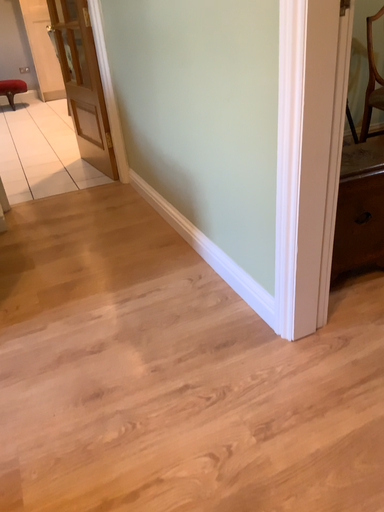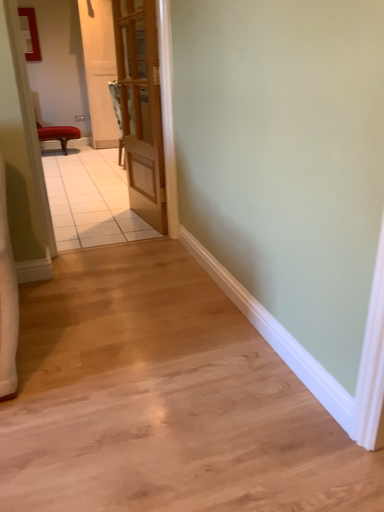
Question: How did the camera likely rotate when shooting the video?

Choices:
 (A) rotated upward
 (B) rotated downward

Answer: (A)